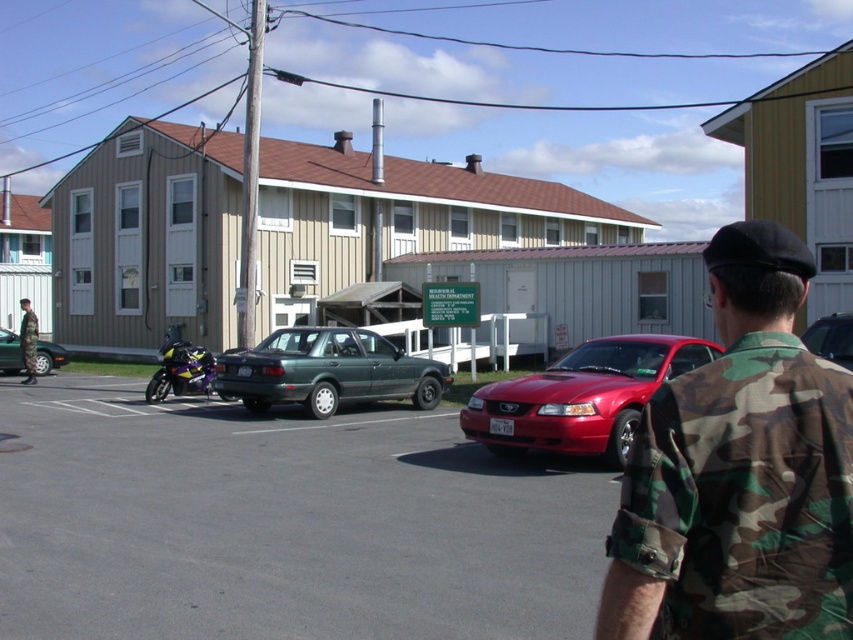
You are a delivery person who needs to place a package on the ground between the shiny purple motorcycle at left and the camouflage uniform at lower left. The package requires a minimum of 3 meters of space. Can you safely place the package there?

The distance between the shiny purple motorcycle at left and the camouflage uniform at lower left is 4.12 meters, which is more than the required 3 meters. Therefore, you can safely place the package there.

You are a delivery person who needs to park your van between the glossy red car at center and the camouflage uniform at lower left. Is there enough space between them to fit your van that is 6 meters long?

The glossy red car at center is located below the camouflage uniform at lower left, but the exact distance between them isn not provided. Without knowing the distance, it is impossible to determine if the van will fit.